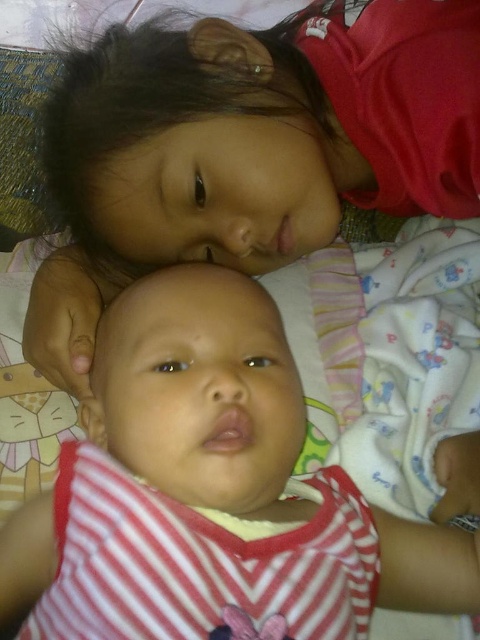
You are a photographer trying to capture a closeup shot of the baby. You are currently positioned at point (409, 42). The camera you are using has a minimum focusing distance of 18 inches. Can you take a clear photo of the baby from your current position?

The distance between point (409, 42) and the camera is 21.31 inches. Since the minimum focusing distance is 18 inches, the camera can focus at this distance, so yes, you can take a clear photo of the baby from your current position.

From the picture: You are a photographer setting up for a family photo. You notice the matte red shirt at upper center and the striped fabric baby at center in the scene. Which object is covering part of the other?

The matte red shirt at upper center is positioned over striped fabric baby at center, so it is covering part of the striped fabric baby at center.

You are a photographer setting up for a family photo. You have a camera with a lens that can focus on objects up to 8 inches apart. You see the matte red shirt at upper center and the striped fabric baby at center in the frame. Can you capture both subjects in focus with this lens?

Yes, the distance between the matte red shirt at upper center and the striped fabric baby at center is 7.74 inches, which is within the lens focus range of up to 8 inches. Both subjects can be captured in focus.